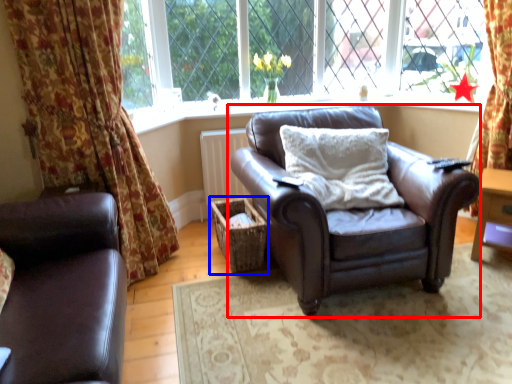
Question: Which object is closer to the camera taking this photo, chair (highlighted by a red box) or crate (highlighted by a blue box)?

Choices:
 (A) chair
 (B) crate

Answer: (A)